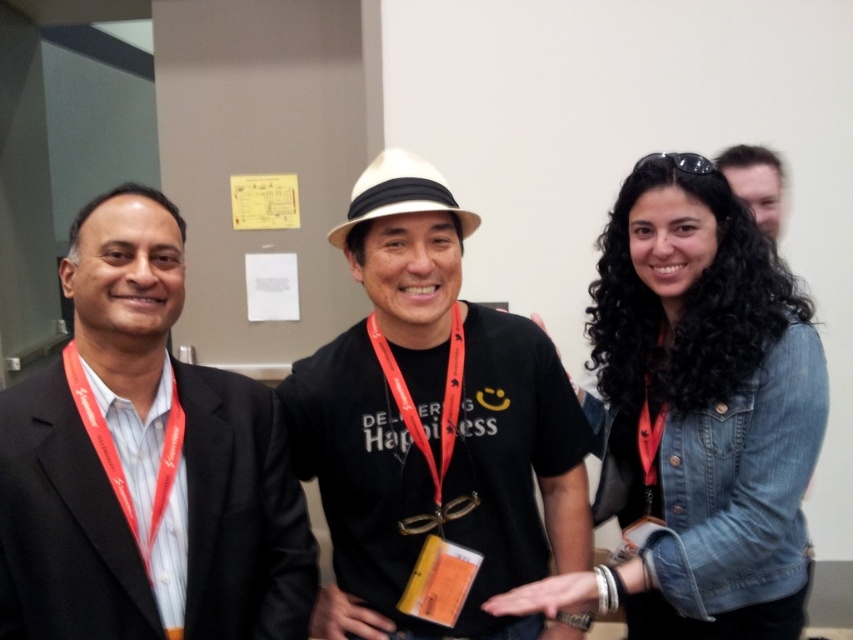
Can you confirm if denim jacket at right is positioned above matte black necktie at left?

Actually, denim jacket at right is below matte black necktie at left.

Where is `denim jacket at right`? This screenshot has height=640, width=853. denim jacket at right is located at coordinates (697, 416).

Does black suit at left appear under smooth skin face at upper right?

Correct, black suit at left is located below smooth skin face at upper right.

Can you confirm if black suit at left is shorter than smooth skin face at upper right?

No.

Find the location of a particular element. This screenshot has width=853, height=640. black suit at left is located at coordinates (144, 465).

From the picture: Who is taller, matte black t-shirt at center or gold metallic medal at center?

With more height is matte black t-shirt at center.

The image size is (853, 640). What are the coordinates of `matte black t-shirt at center` in the screenshot? It's located at (434, 428).